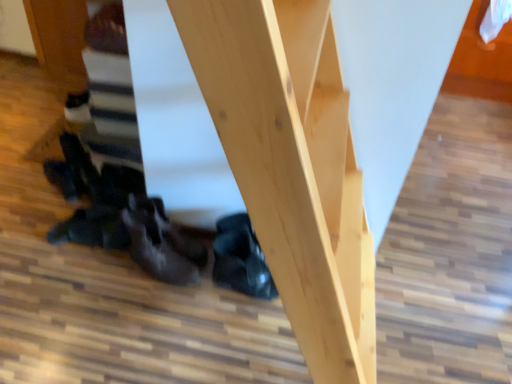
Locate an element on the screen. vacant space in front of black leather shoe at lower center, which is the 1th leather shoe in right-to-left order is located at coordinates (227, 312).